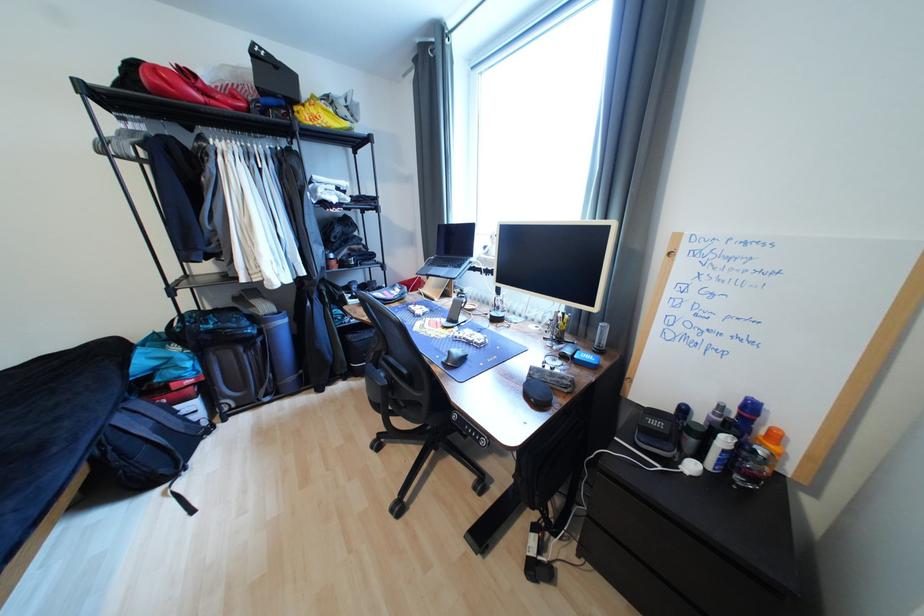
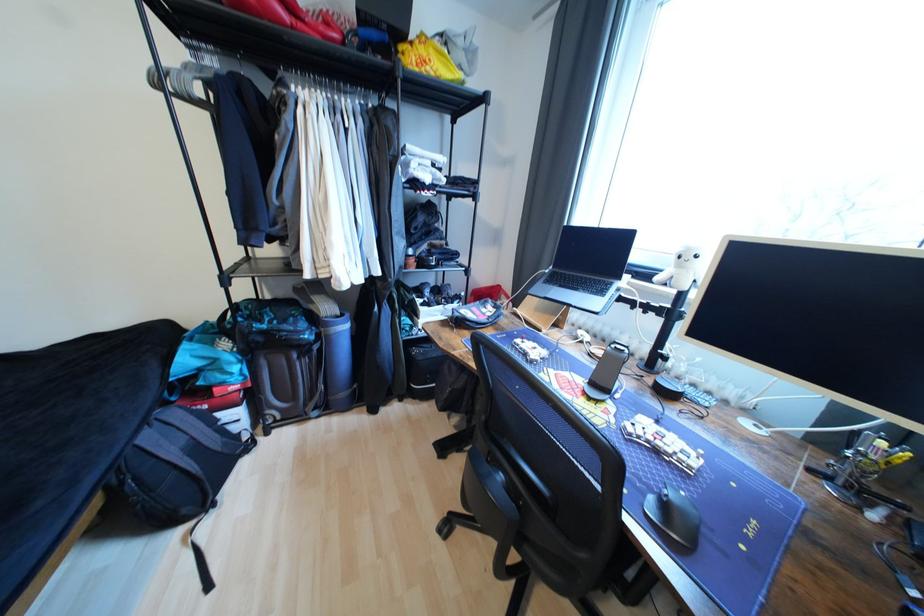
The point at (302, 110) is marked in the first image. Where is the corresponding point in the second image?

(407, 49)